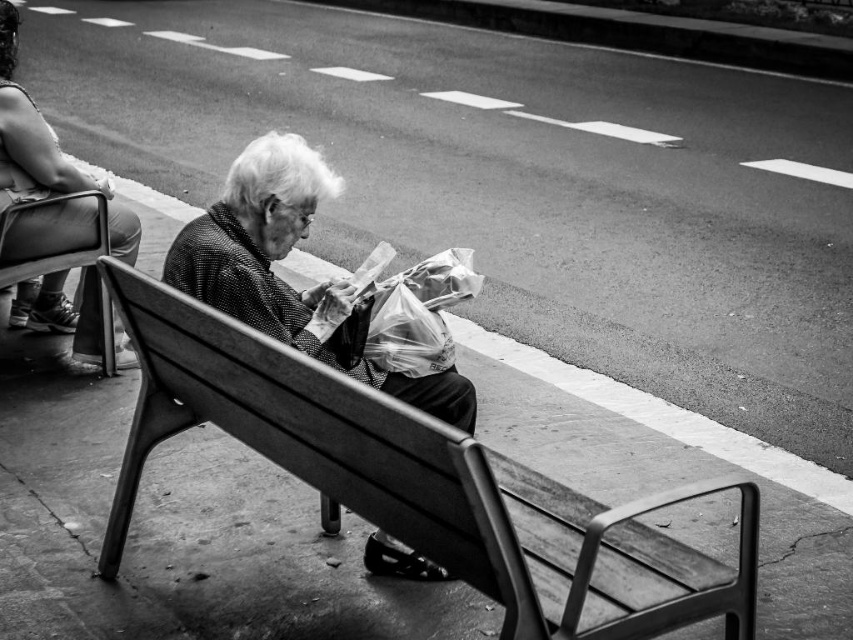
From the picture: You are a pedestrian walking along the sidewalk and see the wooden bench at center and the matte black jacket at upper left. Which object is positioned further to the left?

The matte black jacket at upper left is positioned further to the left than the wooden bench at center.

You are a fashion designer observing this street scene. You notice the smooth fabric sweater at center and the matte black jacket at upper left. Which clothing item is located lower in the image?

The smooth fabric sweater at center is positioned under the matte black jacket at upper left, so it is located lower in the image.

You are standing in front of the street scene photograph. There are two points marked in the image. The first point is at coordinates point (241, 301) and the second is at point (25, 99). Which of these two points is nearer to you?

Point (241, 301) is closer to the camera than point (25, 99), so the first point is nearer to you.